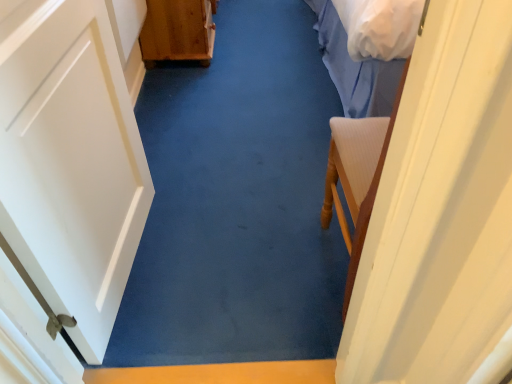
Question: Should I look upward or downward to see wooden chest at left?

Choices:
 (A) down
 (B) up

Answer: (B)